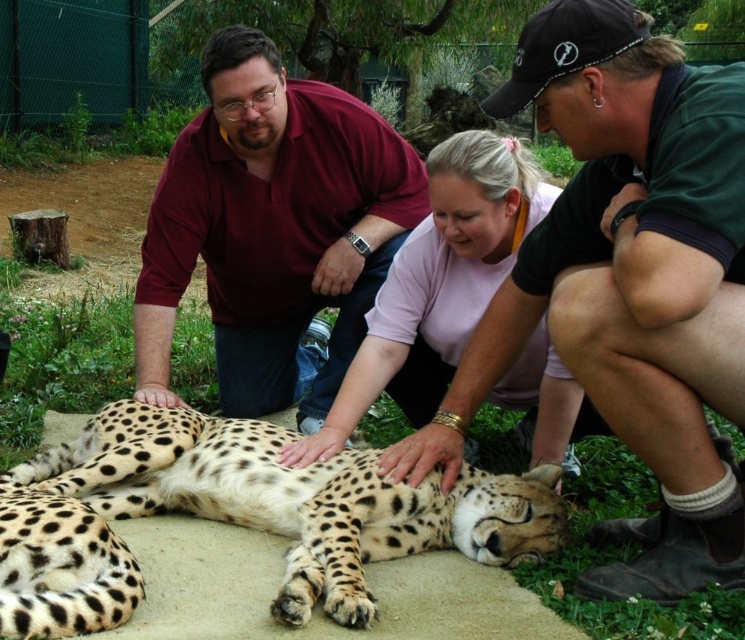
You are a photographer trying to capture a group photo of the green fabric cap at upper right and the maroon shirt at upper left. Which object should you place your camera closer to in order to ensure both are in frame?

The green fabric cap at upper right is positioned on the right side of maroon shirt at upper left. To ensure both are in frame, the camera should be placed closer to the center between the two objects.